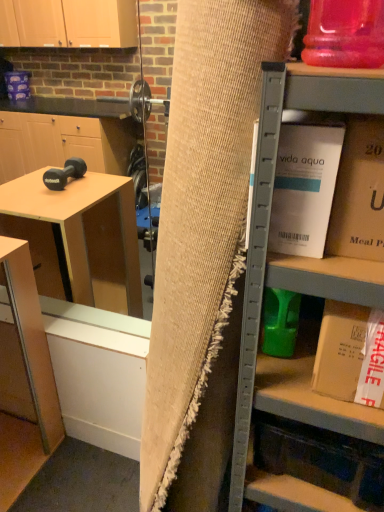
Question: Does matte wood table at lower left appear on the left side of burlap curtain at center?

Choices:
 (A) no
 (B) yes

Answer: (B)

Question: Is matte wood table at lower left taller than burlap curtain at center?

Choices:
 (A) yes
 (B) no

Answer: (B)

Question: Can you see matte wood table at lower left touching burlap curtain at center?

Choices:
 (A) no
 (B) yes

Answer: (A)

Question: From the image's perspective, does matte wood table at lower left appear higher than burlap curtain at center?

Choices:
 (A) no
 (B) yes

Answer: (A)

Question: Does matte wood table at lower left have a lesser height compared to burlap curtain at center?

Choices:
 (A) no
 (B) yes

Answer: (B)

Question: From the image's perspective, would you say matte wood table at lower left is shown under burlap curtain at center?

Choices:
 (A) yes
 (B) no

Answer: (A)

Question: Considering the relative sizes of matte wood table at lower left and white cardboard box at upper right, which ranks as the 2th book in bottom-to-top order, in the image provided, is matte wood table at lower left shorter than white cardboard box at upper right, which ranks as the 2th book in bottom-to-top order,?

Choices:
 (A) no
 (B) yes

Answer: (A)

Question: Does matte wood table at lower left appear on the right side of white cardboard box at upper right, the 2th book from the top?

Choices:
 (A) yes
 (B) no

Answer: (B)

Question: Considering the relative sizes of matte wood table at lower left and white cardboard box at upper right, the 2th book from the top, in the image provided, is matte wood table at lower left taller than white cardboard box at upper right, the 2th book from the top,?

Choices:
 (A) no
 (B) yes

Answer: (B)

Question: From the image's perspective, is matte wood table at lower left on top of white cardboard box at upper right, which ranks as the 2th book in bottom-to-top order?

Choices:
 (A) no
 (B) yes

Answer: (A)

Question: Can you confirm if matte wood table at lower left is bigger than white cardboard box at upper right, the 2th book from the top?

Choices:
 (A) no
 (B) yes

Answer: (B)

Question: Is matte wood table at lower left not within white cardboard box at upper right, which ranks as the 2th book in bottom-to-top order?

Choices:
 (A) no
 (B) yes

Answer: (B)

Question: Considering the relative positions of burlap curtain at center and gold cardboard box at upper right, the 3th book from the bottom, in the image provided, is burlap curtain at center to the left of gold cardboard box at upper right, the 3th book from the bottom, from the viewer's perspective?

Choices:
 (A) no
 (B) yes

Answer: (B)